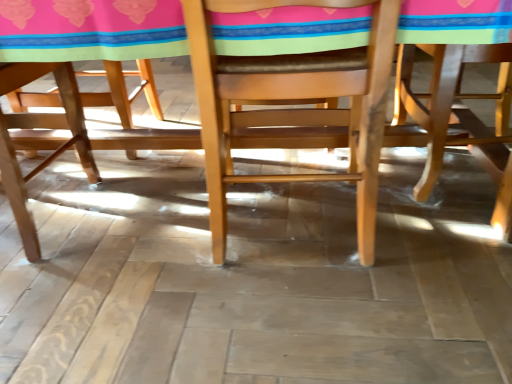
Question: In which direction should I rotate to look at natural wood chair at center, the 1th chair in the left-to-right sequence?

Choices:
 (A) right
 (B) left

Answer: (A)

Question: From a real-world perspective, is light brown wood chair at right, marked as the 2th chair in a left-to-right arrangement, on natural wood chair at center, the second chair viewed from the right?

Choices:
 (A) yes
 (B) no

Answer: (B)

Question: Are light brown wood chair at right, marked as the 2th chair in a left-to-right arrangement, and natural wood chair at center, the second chair viewed from the right, beside each other?

Choices:
 (A) no
 (B) yes

Answer: (A)

Question: Can we say light brown wood chair at right, marked as the first chair in a right-to-left arrangement, lies outside natural wood chair at center, the 1th chair in the left-to-right sequence?

Choices:
 (A) no
 (B) yes

Answer: (B)

Question: Is light brown wood chair at right, marked as the 2th chair in a left-to-right arrangement, aimed at natural wood chair at center, the second chair viewed from the right?

Choices:
 (A) no
 (B) yes

Answer: (B)

Question: Is light brown wood chair at right, marked as the 2th chair in a left-to-right arrangement, facing away from natural wood chair at center, the second chair viewed from the right?

Choices:
 (A) no
 (B) yes

Answer: (A)

Question: From the image's perspective, does light brown wood chair at right, marked as the first chair in a right-to-left arrangement, appear lower than natural wood chair at center, the 1th chair in the left-to-right sequence?

Choices:
 (A) no
 (B) yes

Answer: (A)

Question: From a real-world perspective, is wooden table at center located beneath natural wood chair at center, the 1th chair in the left-to-right sequence?

Choices:
 (A) no
 (B) yes

Answer: (A)

Question: Is wooden table at center facing away from natural wood chair at center, the 1th chair in the left-to-right sequence?

Choices:
 (A) no
 (B) yes

Answer: (B)

Question: Considering the relative sizes of wooden table at center and natural wood chair at center, the second chair viewed from the right, in the image provided, is wooden table at center taller than natural wood chair at center, the second chair viewed from the right,?

Choices:
 (A) yes
 (B) no

Answer: (A)

Question: Can you confirm if wooden table at center is positioned to the left of natural wood chair at center, the 1th chair in the left-to-right sequence?

Choices:
 (A) yes
 (B) no

Answer: (A)

Question: From the image's perspective, is wooden table at center under natural wood chair at center, the 1th chair in the left-to-right sequence?

Choices:
 (A) yes
 (B) no

Answer: (B)

Question: Is wooden table at center surrounding natural wood chair at center, the second chair viewed from the right?

Choices:
 (A) yes
 (B) no

Answer: (A)

Question: From the image's perspective, is light brown wood chair at right, marked as the first chair in a right-to-left arrangement, located above wooden table at center?

Choices:
 (A) no
 (B) yes

Answer: (A)